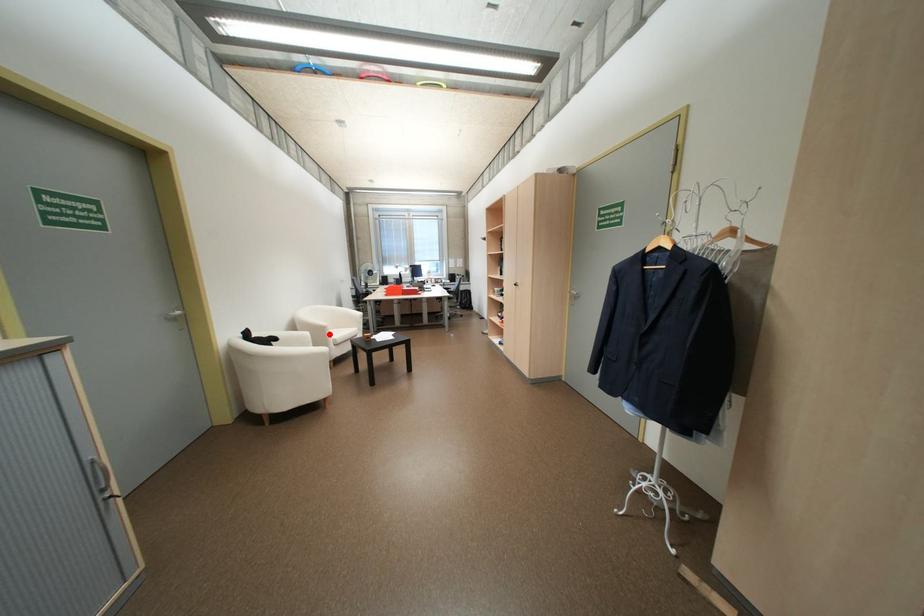
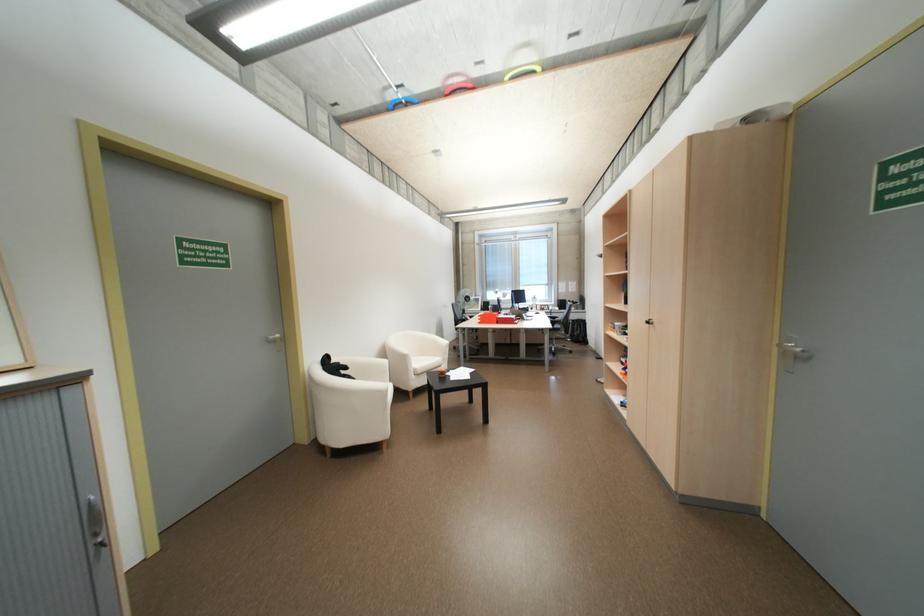
Question: I am providing you with two images of the same scene from different viewpoints. A red point is shown in image1. For the corresponding object point in image2, is it positioned nearer or farther from the camera?

Choices:
 (A) Nearer
 (B) Farther

Answer: (B)